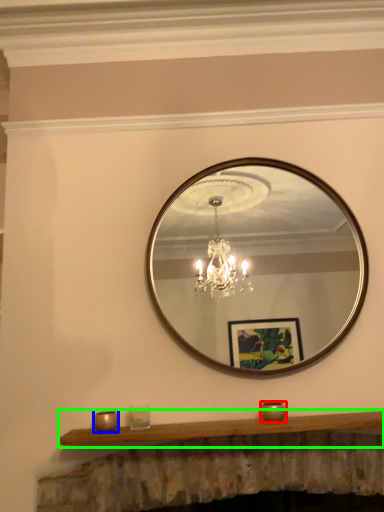
Question: Which is farther away from candle holder (highlighted by a red box)? candle holder (highlighted by a blue box) or mantle (highlighted by a green box)?

Choices:
 (A) candle holder
 (B) mantle

Answer: (A)